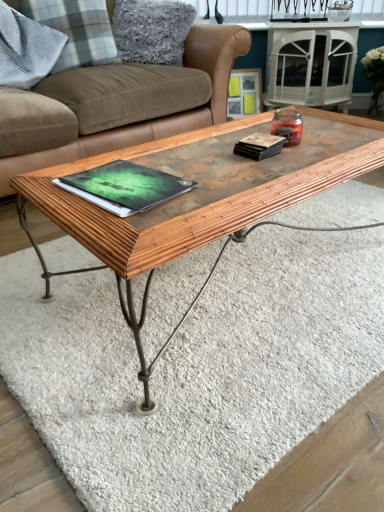
The height and width of the screenshot is (512, 384). What are the coordinates of `free space in front of green matte book at center, which appears as the 2th book when viewed from the top` in the screenshot? It's located at (134, 229).